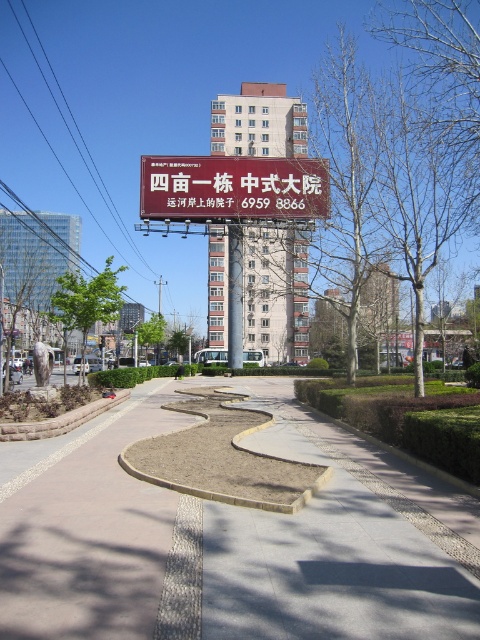
You are a delivery person with a 3m long ladder that needs to be carried horizontally. You are standing on the gray concrete pavement at center and want to reach the matte red sign at center. Can you carry the ladder horizontally through the space between them without tilting it?

The distance between the gray concrete pavement at center and the matte red sign at center is 27.97 meters. Since the ladder is only 3 meters long, there is ample space to carry it horizontally without tilting.

You are standing at the point marked by the coordinates (228, 538) on the gray concrete pavement at center. Looking around, you see the landscaped pathway with hedges and trees, and the large red billboard above. What is directly beneath your feet?

The point marked by the coordinates (228, 538) is directly on the gray concrete pavement at center.